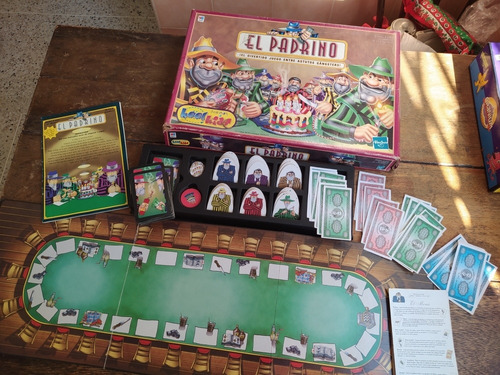
The height and width of the screenshot is (375, 500). What are the coordinates of `board game instructions` in the screenshot? It's located at (417, 321).